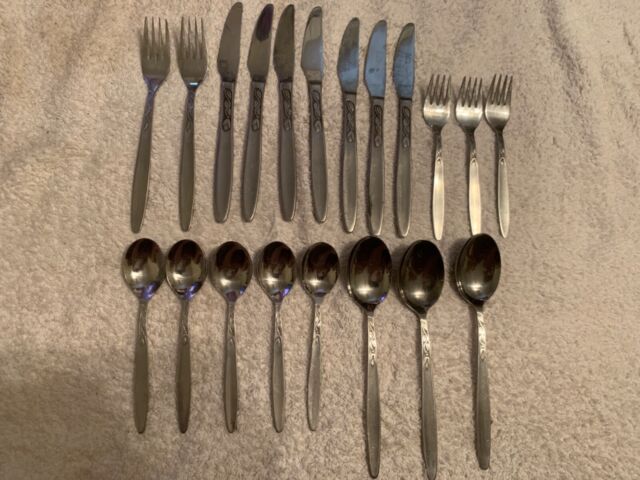
At what (x,y) coordinates should I click in order to perform the action: click on knives. Please return your answer as a coordinate pair (x, y). The height and width of the screenshot is (480, 640). Looking at the image, I should click on (227, 93), (260, 63), (285, 68), (313, 83), (349, 85), (378, 76), (406, 74).